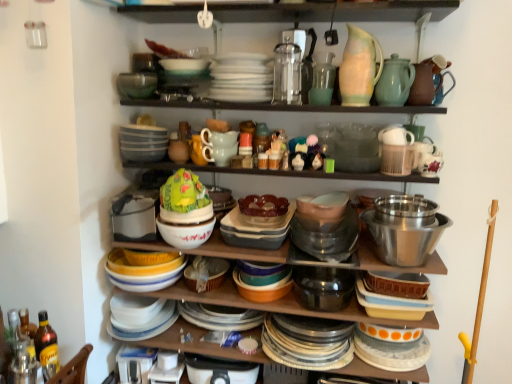
Question: Considering the relative positions of polished stainless steel bowl at right, which is the first bowl from right to left, and green matte cake at center, acting as the 1th food starting from the left, in the image provided, is polished stainless steel bowl at right, which is the first bowl from right to left, to the right of green matte cake at center, acting as the 1th food starting from the left, from the viewer's perspective?

Choices:
 (A) yes
 (B) no

Answer: (A)

Question: Is polished stainless steel bowl at right, which is the first bowl from right to left, not within green matte cake at center, which is the second food from right to left?

Choices:
 (A) yes
 (B) no

Answer: (A)

Question: Is polished stainless steel bowl at right, acting as the second bowl starting from the bottom, looking in the opposite direction of green matte cake at center, which is the second food from right to left?

Choices:
 (A) yes
 (B) no

Answer: (B)

Question: Would you say green matte cake at center, acting as the 1th food starting from the left, is part of polished stainless steel bowl at right, the 3th bowl when ordered from top to bottom,'s contents?

Choices:
 (A) yes
 (B) no

Answer: (B)

Question: Considering the relative sizes of polished stainless steel bowl at right, which is the first bowl from right to left, and green matte cake at center, acting as the 1th food starting from the left, in the image provided, is polished stainless steel bowl at right, which is the first bowl from right to left, bigger than green matte cake at center, acting as the 1th food starting from the left,?

Choices:
 (A) yes
 (B) no

Answer: (A)

Question: Considering their positions, is translucent glass bowl at center, arranged as the 2th food when viewed from the left, located in front of or behind matte brown pitcher at upper right, arranged as the first tableware when viewed from the right?

Choices:
 (A) behind
 (B) front

Answer: (B)

Question: Does point [x=276, y=206] appear closer or farther from the camera than point [x=424, y=64]?

Choices:
 (A) farther
 (B) closer

Answer: (A)

Question: Is translucent glass bowl at center, arranged as the 2th food when viewed from the left, bigger or smaller than matte brown pitcher at upper right, arranged as the first tableware when viewed from the right?

Choices:
 (A) small
 (B) big

Answer: (B)

Question: Considering the positions of translucent glass bowl at center, arranged as the 2th food when viewed from the left, and matte brown pitcher at upper right, arranged as the first tableware when viewed from the right, in the image, is translucent glass bowl at center, arranged as the 2th food when viewed from the left, taller or shorter than matte brown pitcher at upper right, arranged as the first tableware when viewed from the right,?

Choices:
 (A) short
 (B) tall

Answer: (A)

Question: Looking at their shapes, would you say matte white bowl at center is wider or thinner than matte brown pitcher at upper right, the fifth tableware in the left-to-right sequence?

Choices:
 (A) wide
 (B) thin

Answer: (A)

Question: Considering their positions, is matte white bowl at center located in front of or behind matte brown pitcher at upper right, the fifth tableware in the left-to-right sequence?

Choices:
 (A) front
 (B) behind

Answer: (B)

Question: Is matte white bowl at center to the left or to the right of matte brown pitcher at upper right, arranged as the first tableware when viewed from the right, in the image?

Choices:
 (A) right
 (B) left

Answer: (B)

Question: From a real-world perspective, is matte white bowl at center above or below matte brown pitcher at upper right, arranged as the first tableware when viewed from the right?

Choices:
 (A) above
 (B) below

Answer: (B)

Question: Is matte glass vase at upper center, the second tableware from the left, in front of or behind green glass bowl at upper center, arranged as the fourth bowl when ordered from the bottom, in the image?

Choices:
 (A) behind
 (B) front

Answer: (B)

Question: In terms of height, does matte glass vase at upper center, the second tableware from the left, look taller or shorter compared to green glass bowl at upper center, arranged as the fourth bowl when ordered from the bottom?

Choices:
 (A) short
 (B) tall

Answer: (B)